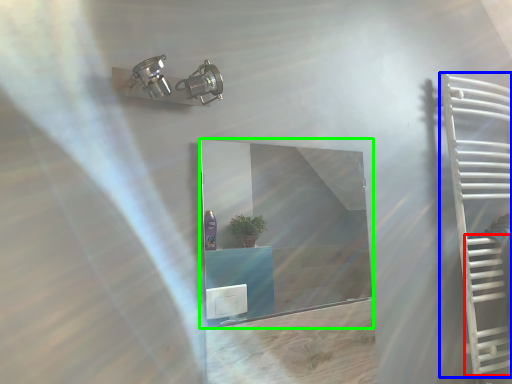
Question: Which is farther away from stairs (highlighted by a red box)? ladder (highlighted by a blue box) or mirror (highlighted by a green box)?

Choices:
 (A) ladder
 (B) mirror

Answer: (B)